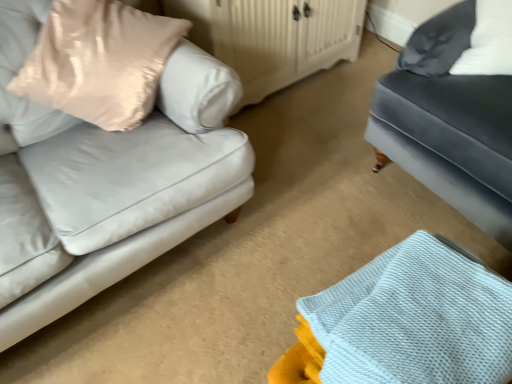
Where is `white wood dresser at center`? Image resolution: width=512 pixels, height=384 pixels. white wood dresser at center is located at coordinates (273, 37).

Describe the element at coordinates (273, 37) in the screenshot. I see `white wood dresser at center` at that location.

Locate an element on the screen. Image resolution: width=512 pixels, height=384 pixels. matte gray couch at right is located at coordinates (454, 112).

What is the approximate width of satin beige pillow at left?

satin beige pillow at left is 15.96 inches wide.

The width and height of the screenshot is (512, 384). I want to click on white wood dresser at center, so click(273, 37).

Between matte gray couch at right and satin beige pillow at left, which one appears on the right side from the viewer's perspective?

Positioned to the right is matte gray couch at right.

Which object is further away from the camera taking this photo, matte gray couch at right or satin beige pillow at left?

Positioned behind is satin beige pillow at left.

From a real-world perspective, is matte gray couch at right located higher than satin beige pillow at left?

No, from a real-world perspective, matte gray couch at right is not over satin beige pillow at left

Which point is more distant from viewer, (509, 127) or (40, 88)?

Point (40, 88)

Considering the relative positions of white wood dresser at center and white textured fabric at lower right in the image provided, is white wood dresser at center behind white textured fabric at lower right?

Yes, white wood dresser at center is further from the viewer.

The width and height of the screenshot is (512, 384). I want to click on dresser behind the white textured fabric at lower right, so click(x=273, y=37).

Considering the sizes of objects white wood dresser at center and white textured fabric at lower right in the image provided, who is smaller, white wood dresser at center or white textured fabric at lower right?

white textured fabric at lower right.

Between point (237, 27) and point (361, 270), which one is positioned behind?

Positioned behind is point (237, 27).

Is point (96, 28) more distant than point (483, 307)?

Yes, it is behind point (483, 307).

Is satin beige pillow at left positioned behind white textured fabric at lower right?

Yes, it is behind white textured fabric at lower right.

Does satin beige pillow at left have a lesser width compared to white textured fabric at lower right?

Indeed, satin beige pillow at left has a lesser width compared to white textured fabric at lower right.

From the image's perspective, which object appears higher, satin beige pillow at left or matte gray couch at right?

satin beige pillow at left.

Is satin beige pillow at left shorter than matte gray couch at right?

Yes.

Considering the relative sizes of satin beige pillow at left and matte gray couch at right in the image provided, is satin beige pillow at left thinner than matte gray couch at right?

Indeed, satin beige pillow at left has a lesser width compared to matte gray couch at right.

Is point (137, 52) positioned behind point (488, 99)?

No, (137, 52) is closer to viewer.

From the image's perspective, which object appears higher, white textured fabric at lower right or white wood dresser at center?

white wood dresser at center is shown above in the image.

Considering the relative positions of white textured fabric at lower right and white wood dresser at center in the image provided, is white textured fabric at lower right to the left of white wood dresser at center from the viewer's perspective?

Incorrect, white textured fabric at lower right is not on the left side of white wood dresser at center.

Is white textured fabric at lower right outside of white wood dresser at center?

That's correct, white textured fabric at lower right is outside of white wood dresser at center.

Can you confirm if white textured fabric at lower right is smaller than satin beige pillow at left?

Yes.

The height and width of the screenshot is (384, 512). Find the location of `pillow on the left of white textured fabric at lower right`. pillow on the left of white textured fabric at lower right is located at coordinates (99, 61).

How distant is white textured fabric at lower right from satin beige pillow at left?

1.01 meters.

Which point is more forward, (x=338, y=321) or (x=80, y=116)?

The point (x=338, y=321) is more forward.

Which is in front, white wood dresser at center or satin beige pillow at left?

satin beige pillow at left is more forward.

Considering the relative positions of white wood dresser at center and satin beige pillow at left in the image provided, is white wood dresser at center to the left or to the right of satin beige pillow at left?

white wood dresser at center is positioned on satin beige pillow at left's right side.

Does white wood dresser at center turn towards satin beige pillow at left?

No, white wood dresser at center is not oriented towards satin beige pillow at left.

Would you say satin beige pillow at left is part of white wood dresser at center's contents?

No, satin beige pillow at left is located outside of white wood dresser at center.

Image resolution: width=512 pixels, height=384 pixels. Find the location of `pillow above the matte gray couch at right (from the image's perspective)`. pillow above the matte gray couch at right (from the image's perspective) is located at coordinates (99, 61).

In order to click on dresser lying on the left of white textured fabric at lower right in this screenshot , I will do `click(273, 37)`.

Looking at this image, estimate the real-world distances between objects in this image. Which object is closer to matte gray couch at right, white wood dresser at center or white textured fabric at lower right?

white textured fabric at lower right.

Estimate the real-world distances between objects in this image. Which object is closer to satin beige pillow at left, matte gray couch at right or white textured fabric at lower right?

matte gray couch at right lies closer to satin beige pillow at left than the other object.

From the image, which object appears to be nearer to white textured fabric at lower right, satin beige pillow at left or white wood dresser at center?

satin beige pillow at left is closer to white textured fabric at lower right.

When comparing their distances from white textured fabric at lower right, does white wood dresser at center or matte gray couch at right seem further?

white wood dresser at center is further to white textured fabric at lower right.

Based on their spatial positions, is white textured fabric at lower right or white wood dresser at center further from satin beige pillow at left?

Among the two, white textured fabric at lower right is located further to satin beige pillow at left.

When comparing their distances from white textured fabric at lower right, does satin beige pillow at left or matte gray couch at right seem further?

satin beige pillow at left.

From the image, which object appears to be nearer to white wood dresser at center, matte gray couch at right or satin beige pillow at left?

satin beige pillow at left lies closer to white wood dresser at center than the other object.

In the scene shown: When comparing their distances from white wood dresser at center, does white textured fabric at lower right or matte gray couch at right seem closer?

matte gray couch at right is positioned closer to the anchor white wood dresser at center.

Where is `material situated between satin beige pillow at left and matte gray couch at right from left to right`? This screenshot has width=512, height=384. material situated between satin beige pillow at left and matte gray couch at right from left to right is located at coordinates (415, 319).

The width and height of the screenshot is (512, 384). What are the coordinates of `studio couch between white wood dresser at center and white textured fabric at lower right in the vertical direction` in the screenshot? It's located at (454, 112).

Locate an element on the screen. dresser between satin beige pillow at left and matte gray couch at right in the horizontal direction is located at coordinates click(273, 37).

You are a GUI agent. You are given a task and a screenshot of the screen. Output one action in this format:
    pyautogui.click(x=<x>, y=<y>)
    Task: Click on the pillow that lies between white wood dresser at center and white textured fabric at lower right from top to bottom
    The height and width of the screenshot is (384, 512).
    Given the screenshot: What is the action you would take?
    pyautogui.click(x=99, y=61)